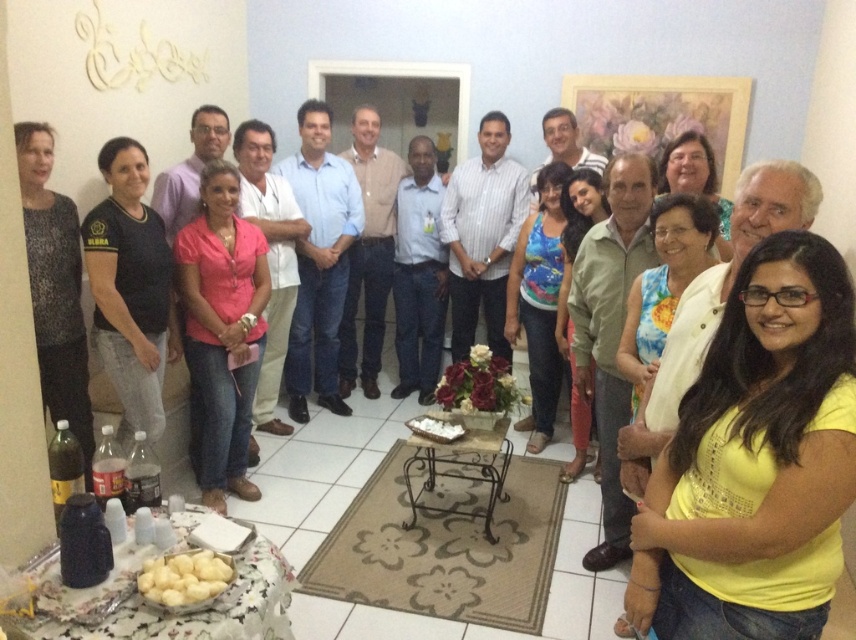
You are taking a photo of the group and notice the black matte shirt at left and the sparkly silver dress at left. Which one is closer to the camera?

The black matte shirt at left is closer to the camera because the sparkly silver dress at left is behind it.

Based on the coordinates provided, which object is located at point (131,288) in the scene?

The point (131,288) marks the location of the black matte shirt at left.

Based on the photo, you are a photographer trying to capture a closeup of the sparkly silver dress at left and the multicolored floral dress at center. Which dress should you zoom in on first to ensure both are in focus?

The sparkly silver dress at left is smaller than the multicolored floral dress at center, so you should focus on the sparkly silver dress at left first to ensure both are in focus.